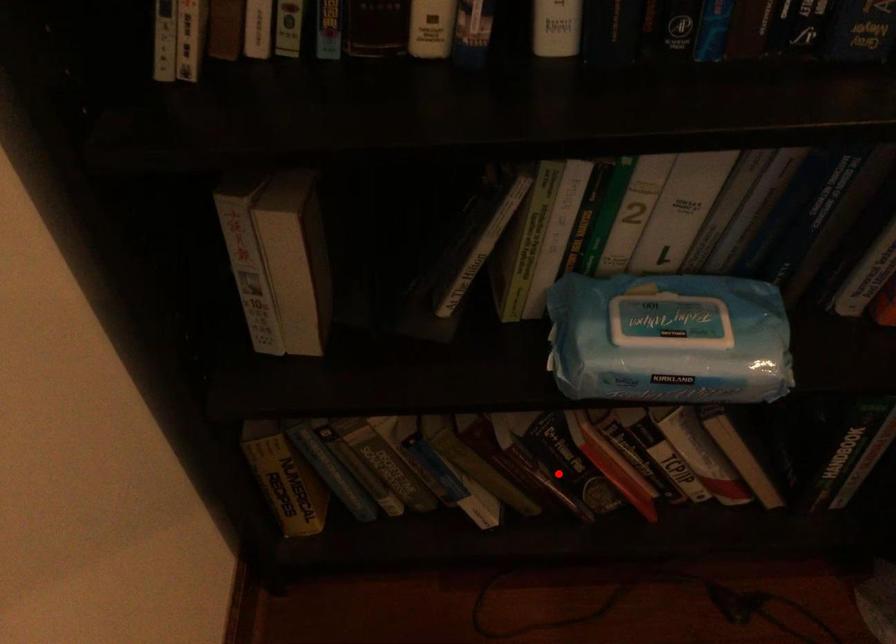
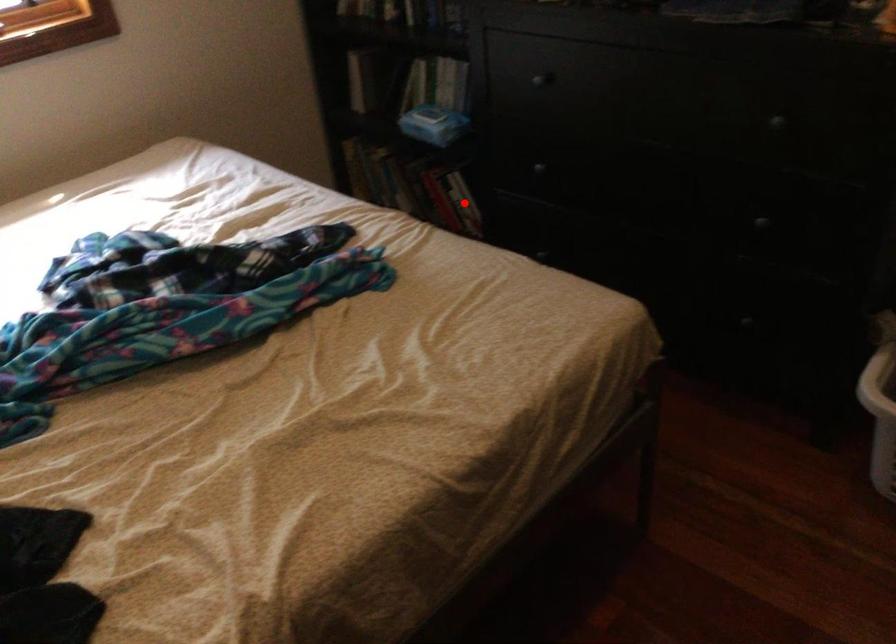
I am providing you with two images of the same scene from different viewpoints. A red point is marked on the first image and another point is marked on the second image. Is the marked point in image1 the same physical position as the marked point in image2?

No